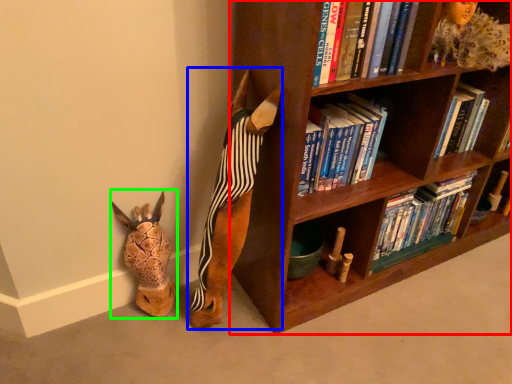
Question: Based on their relative distances, which object is farther from bookcase (highlighted by a red box)? Choose from animal (highlighted by a blue box) and animal (highlighted by a green box).

Choices:
 (A) animal
 (B) animal

Answer: (B)